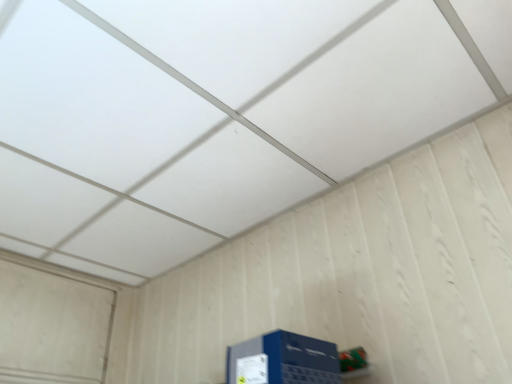
Question: Should I look upward or downward to see blue cardboard box at lower right?

Choices:
 (A) down
 (B) up

Answer: (A)